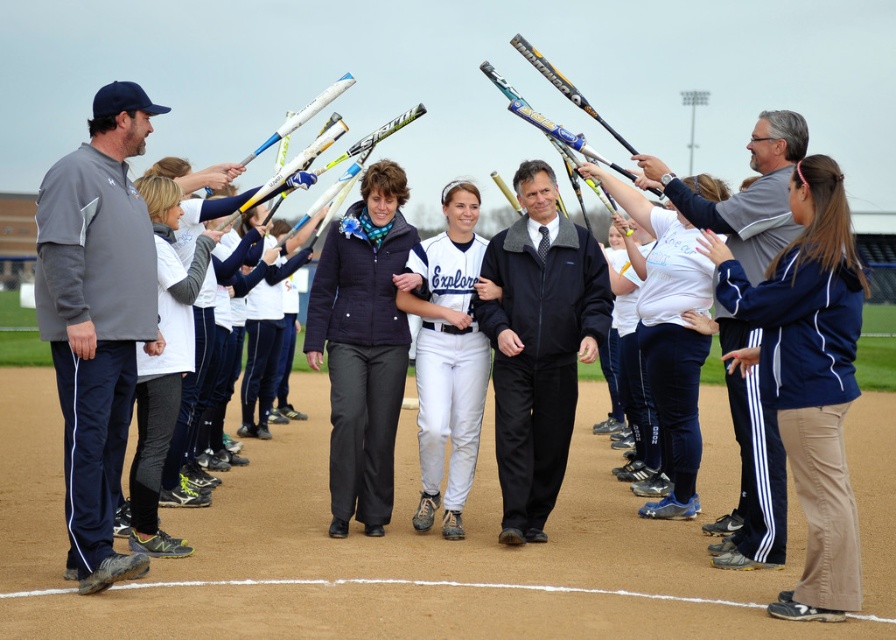
Question: Which of the following is the farthest from the observer?

Choices:
 (A) white matte uniform at center
 (B) blue track pants at center

Answer: (A)

Question: Can you confirm if blue track pants at center is wider than white matte uniform at center?

Choices:
 (A) no
 (B) yes

Answer: (B)

Question: Does blue track pants at center have a smaller size compared to white matte uniform at center?

Choices:
 (A) yes
 (B) no

Answer: (B)

Question: Among these points, which one is nearest to the camera?

Choices:
 (A) (791, 211)
 (B) (438, 436)

Answer: (A)

Question: Is blue track pants at center above white matte uniform at center?

Choices:
 (A) yes
 (B) no

Answer: (B)

Question: Which point is closer to the camera?

Choices:
 (A) blue track pants at center
 (B) white matte uniform at center

Answer: (A)